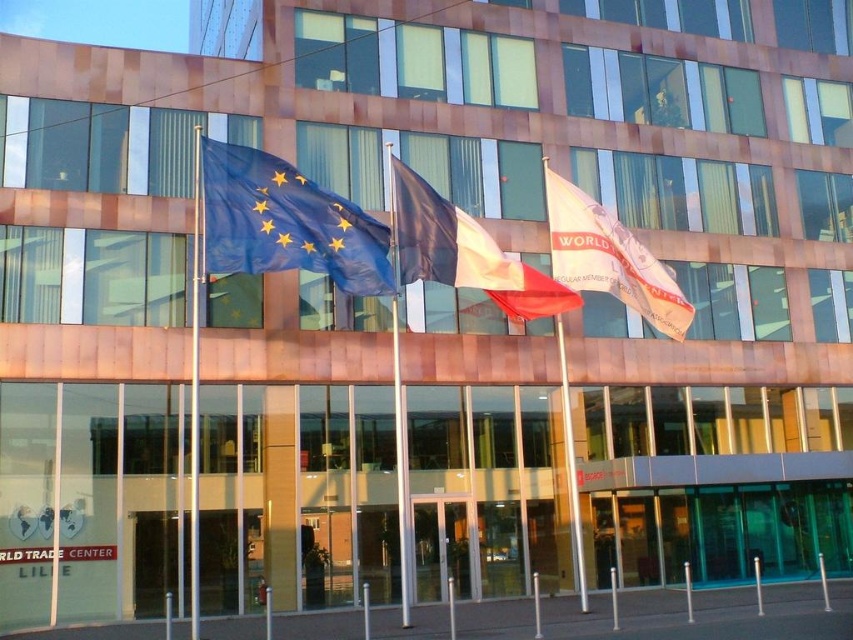
Who is taller, blue fabric flag at center or white fabric flag at center?

Standing taller between the two is white fabric flag at center.

Is point (300, 237) positioned behind point (664, 300)?

That is False.

Locate an element on the screen. The width and height of the screenshot is (853, 640). blue fabric flag at center is located at coordinates (286, 221).

I want to click on blue fabric flag at center, so click(286, 221).

Is metallic flag pole at center to the left of silver metallic flag pole at center from the viewer's perspective?

Indeed, metallic flag pole at center is positioned on the left side of silver metallic flag pole at center.

Where is `metallic flag pole at center`? The height and width of the screenshot is (640, 853). metallic flag pole at center is located at coordinates (195, 387).

Where is `metallic flag pole at center`? This screenshot has width=853, height=640. metallic flag pole at center is located at coordinates (195, 387).

Which is in front, point (218, 140) or point (548, 310)?

Positioned in front is point (548, 310).

In the scene shown: Does blue fabric flag at center have a lesser width compared to white cotton flag at center?

Indeed, blue fabric flag at center has a lesser width compared to white cotton flag at center.

Where is `blue fabric flag at center`? The height and width of the screenshot is (640, 853). blue fabric flag at center is located at coordinates (286, 221).

Image resolution: width=853 pixels, height=640 pixels. Find the location of `blue fabric flag at center`. blue fabric flag at center is located at coordinates (286, 221).